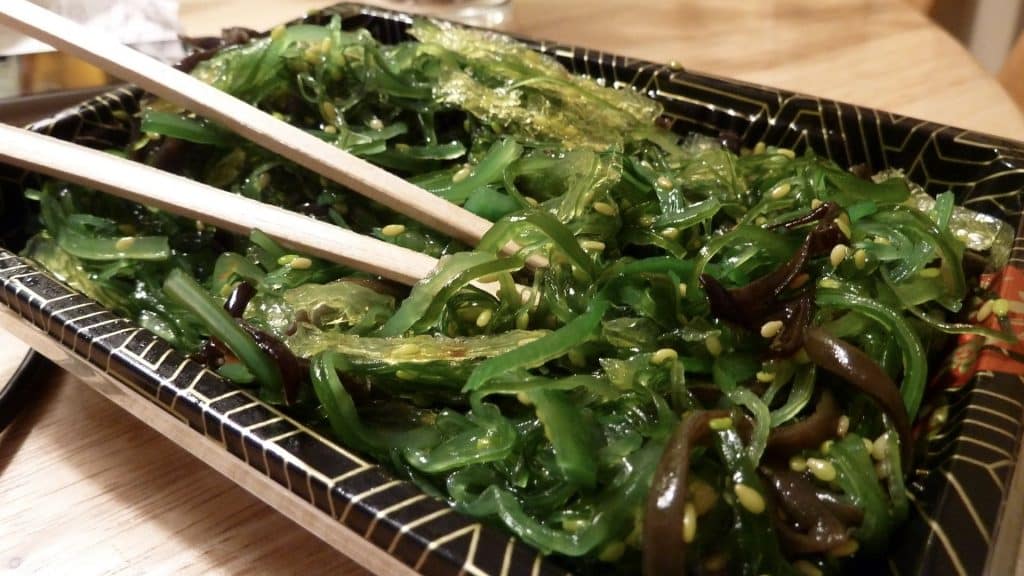
This screenshot has height=576, width=1024. Identify the location of chopsticks. (301, 128), (219, 219).